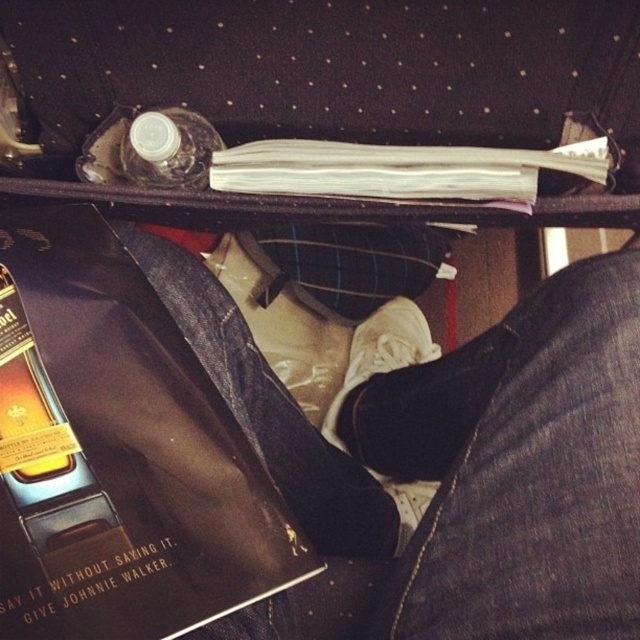
You are packing for a trip and need to know if there is enough space between the shiny leather book at lower left and the white paper book at upper center to fit a 6.5 inch wide travel guide. Can you confirm?

The distance between the shiny leather book at lower left and the white paper book at upper center is 7.64 inches, which is wider than the 6.5 inch travel guide, so there is enough space to fit it between them.

You are packing a suitcase and need to know if the shiny leather book at lower left will fit under the transparent plastic bottle at upper center. Can you confirm if there is enough space?

The shiny leather book at lower left is located below the transparent plastic bottle at upper center, so there is enough space for it to fit underneath.

You are packing for a trip and need to access the shiny leather book at lower left and the white paper book at upper center. Which book is closer to the top of the suitcase?

The white paper book at upper center is closer to the top of the suitcase since the shiny leather book at lower left is positioned under it.